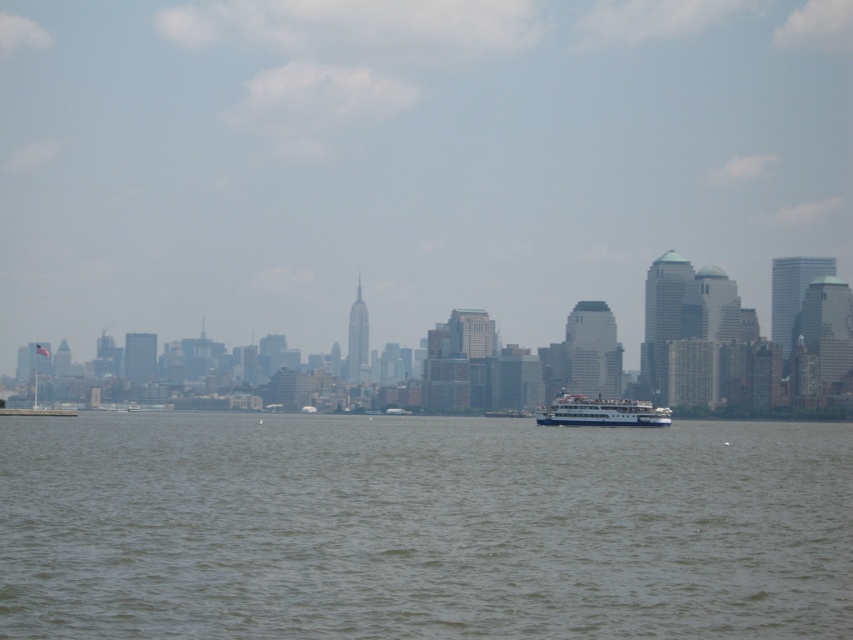
Which is more to the right, brown water at center or white glossy ferry at center?

From the viewer's perspective, white glossy ferry at center appears more on the right side.

Does brown water at center have a greater width compared to white glossy ferry at center?

Yes, brown water at center is wider than white glossy ferry at center.

Between point (242, 458) and point (577, 412), which one is positioned in front?

Point (242, 458)

The height and width of the screenshot is (640, 853). In order to click on brown water at center in this screenshot , I will do `click(421, 528)`.